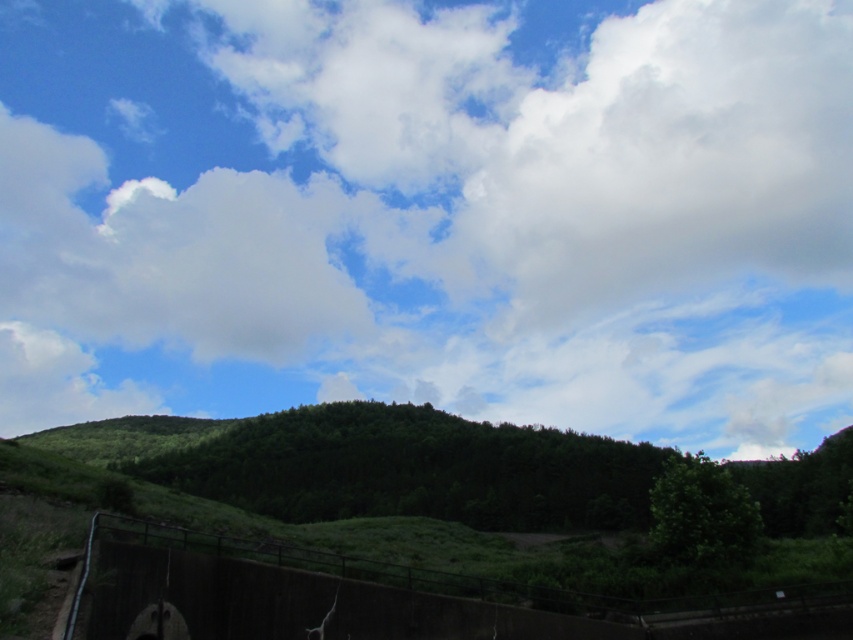
You are a landscape painter planning to paint the scene. You want to ensure the white fluffy cloud at upper center and the metallic gray fence at lower left are proportionally accurate. Which object should you make larger in your painting?

The white fluffy cloud at upper center should be painted larger than the metallic gray fence at lower left because it is larger in size according to the description.

You are standing at the base of the hill and looking towards the sky. Which object, the white fluffy cloud at upper center or the metallic gray fence at lower left, is higher in the sky?

The white fluffy cloud at upper center is higher in the sky than the metallic gray fence at lower left because it is positioned above it.

You are an architect designing a new observation deck that will be built on the concrete structure in the scene. The deck will have a glass panel that needs to align with the white fluffy cloud at upper center in the image. To ensure the glass panel is positioned correctly, what are the coordinates where you should place it?

The white fluffy cloud at upper center is located at coordinates 0.333 on the x axis and 0.506 on the y axis, so the glass panel should be placed at point (431,212) to align with it.